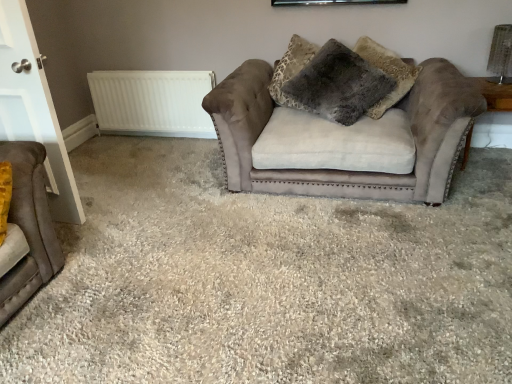
Question: Is point (25, 274) positioned closer to the camera than point (353, 89)?

Choices:
 (A) farther
 (B) closer

Answer: (B)

Question: From the image's perspective, is velvet brown studio couch at left, marked as the 2th studio couch in a back-to-front arrangement, positioned above or below fuzzy gray pillow at center?

Choices:
 (A) above
 (B) below

Answer: (B)

Question: Estimate the real-world distances between objects in this image. Which object is closer to the fuzzy gray pillow at center?

Choices:
 (A) wooden side table at right
 (B) suede-like beige couch at center, arranged as the second studio couch when viewed from the front
 (C) suede couch at center
 (D) white glossy door at left
 (E) velvet brown studio couch at left, the 1th studio couch positioned from the front

Answer: (B)

Question: Which is nearer to the suede couch at center?

Choices:
 (A) velvet brown studio couch at left, marked as the 2th studio couch in a back-to-front arrangement
 (B) fuzzy gray pillow at center
 (C) wooden side table at right
 (D) white matte radiator at upper left
 (E) suede-like beige couch at center, placed as the first studio couch when sorted from back to front

Answer: (E)